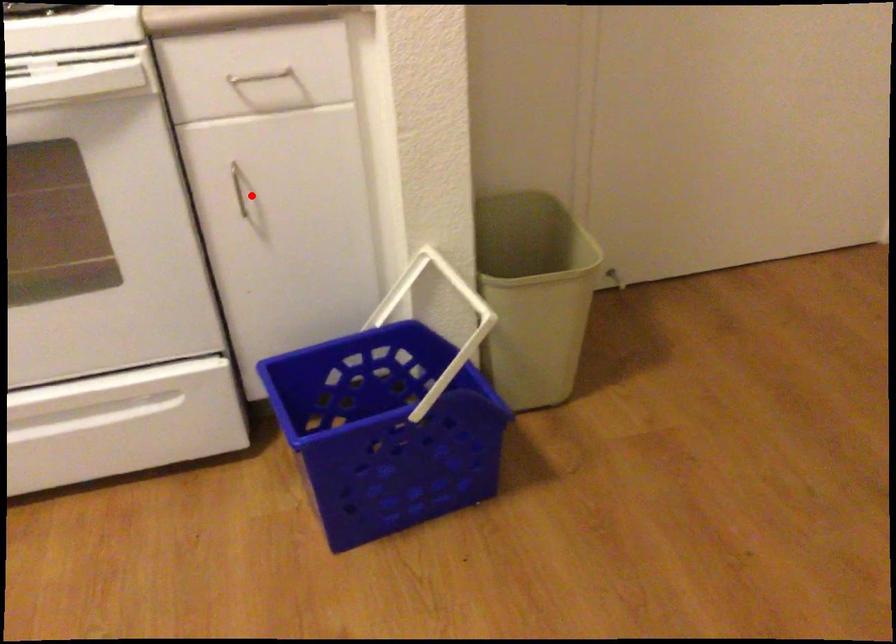
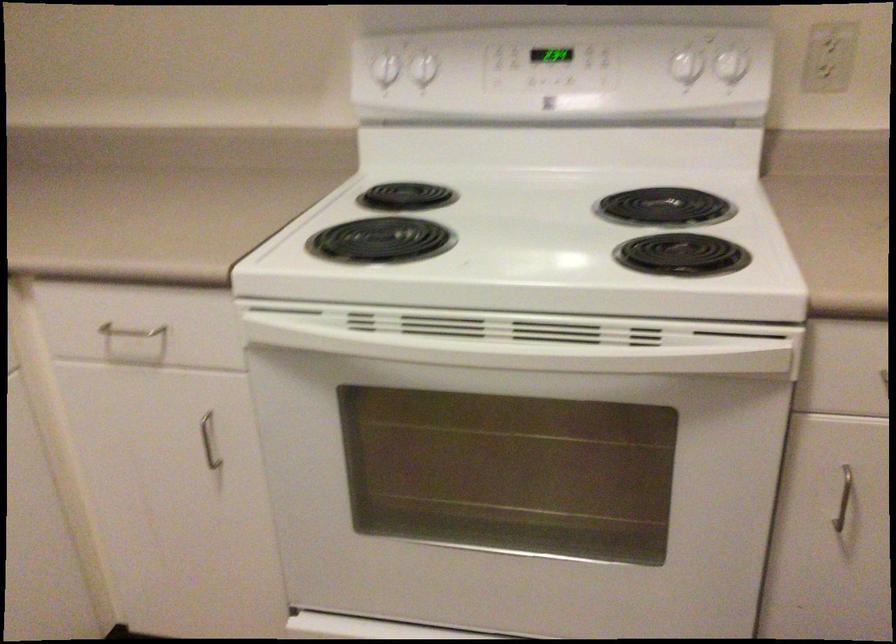
The point at the highlighted location is marked in the first image. Where is the corresponding point in the second image?

(842, 498)